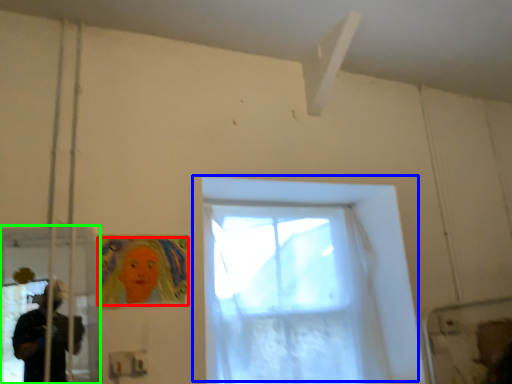
Question: Which is nearer to the woman (highlighted by a red box)? window (highlighted by a blue box) or screen door (highlighted by a green box).

Choices:
 (A) window
 (B) screen door

Answer: (B)